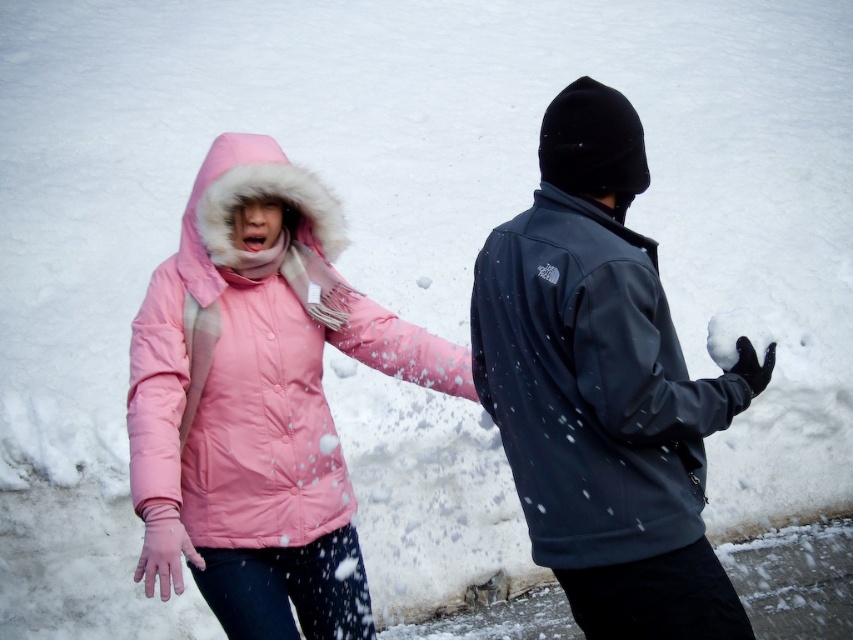
Is pink down jacket at center further to camera compared to black fuzzy glove at center?

That is False.

Between pink down jacket at center and black fuzzy glove at center, which one appears on the right side from the viewer's perspective?

black fuzzy glove at center is more to the right.

Where is `pink down jacket at center`? The height and width of the screenshot is (640, 853). pink down jacket at center is located at coordinates (257, 364).

Who is higher up, dark gray fleece jacket at right or pink down jacket at center?

Positioned higher is pink down jacket at center.

Who is more distant from viewer, (643,493) or (322,289)?

Positioned behind is point (322,289).

Between point (662, 381) and point (178, 369), which one is positioned behind?

The point (178, 369) is more distant.

At what (x,y) coordinates should I click in order to perform the action: click on dark gray fleece jacket at right. Please return your answer as a coordinate pair (x, y). Image resolution: width=853 pixels, height=640 pixels. Looking at the image, I should click on (601, 388).

Which of these two, dark gray fleece jacket at right or black fuzzy glove at center, stands taller?

With more height is dark gray fleece jacket at right.

Does point (572, 289) lie behind point (753, 376)?

No, (572, 289) is closer to viewer.

Where is `dark gray fleece jacket at right`? Image resolution: width=853 pixels, height=640 pixels. dark gray fleece jacket at right is located at coordinates (601, 388).